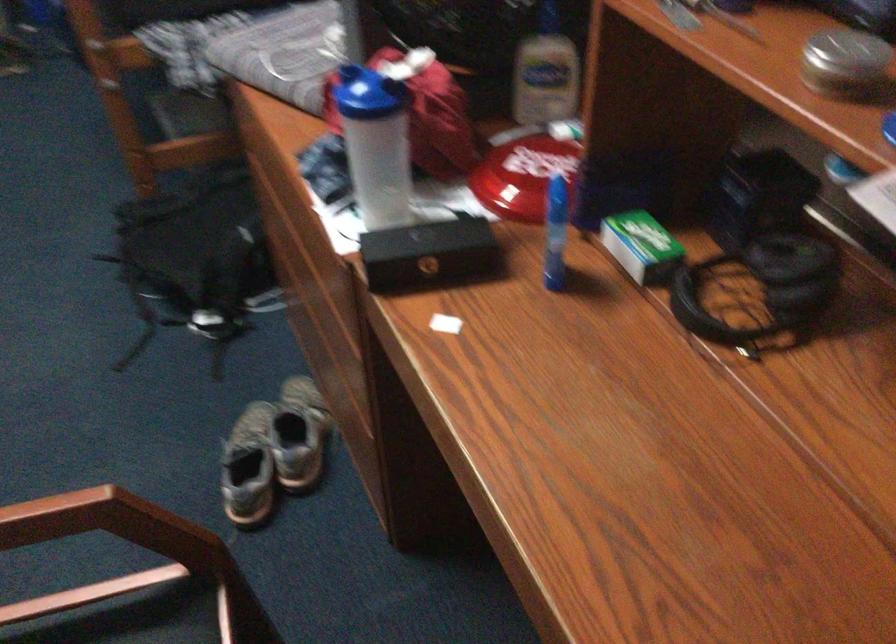
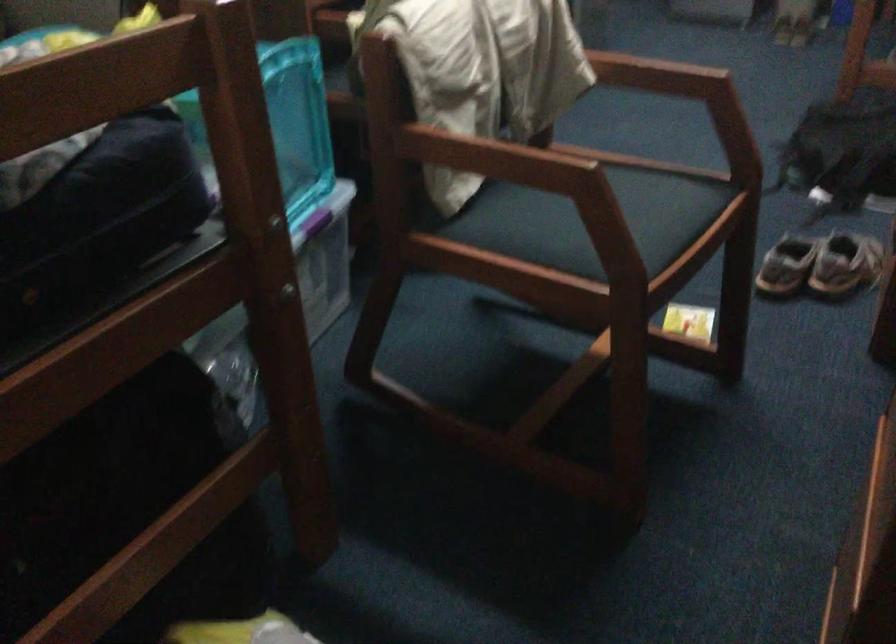
Question: How did the camera likely rotate?

Choices:
 (A) Left
 (B) Right
 (C) Up
 (D) Down

Answer: (A)